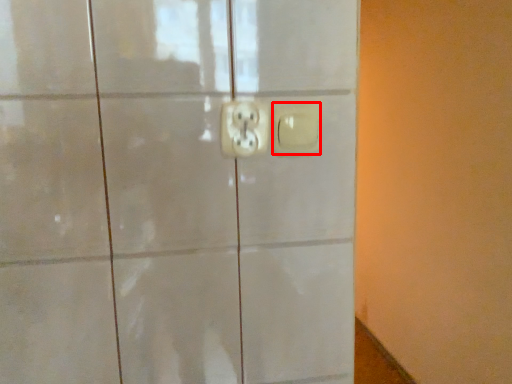
Question: Considering the relative positions of light switch (annotated by the red box) and power plugs and sockets in the image provided, where is light switch (annotated by the red box) located with respect to the staircase?

Choices:
 (A) left
 (B) right

Answer: (B)